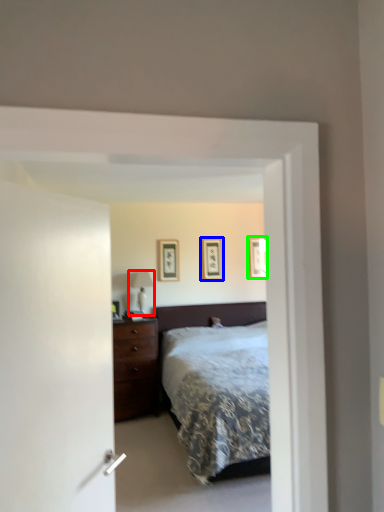
Question: Based on their relative distances, which object is nearer to table lamp (highlighted by a red box)? Choose from picture frame (highlighted by a blue box) and picture frame (highlighted by a green box).

Choices:
 (A) picture frame
 (B) picture frame

Answer: (A)